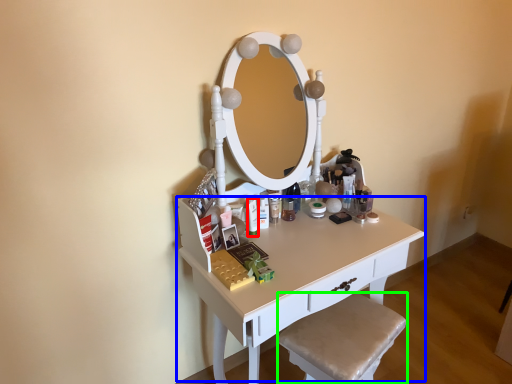
Question: Which object is the farthest from toiletry (highlighted by a red box)? Choose among these: table (highlighted by a blue box) or step stool (highlighted by a green box).

Choices:
 (A) table
 (B) step stool

Answer: (B)